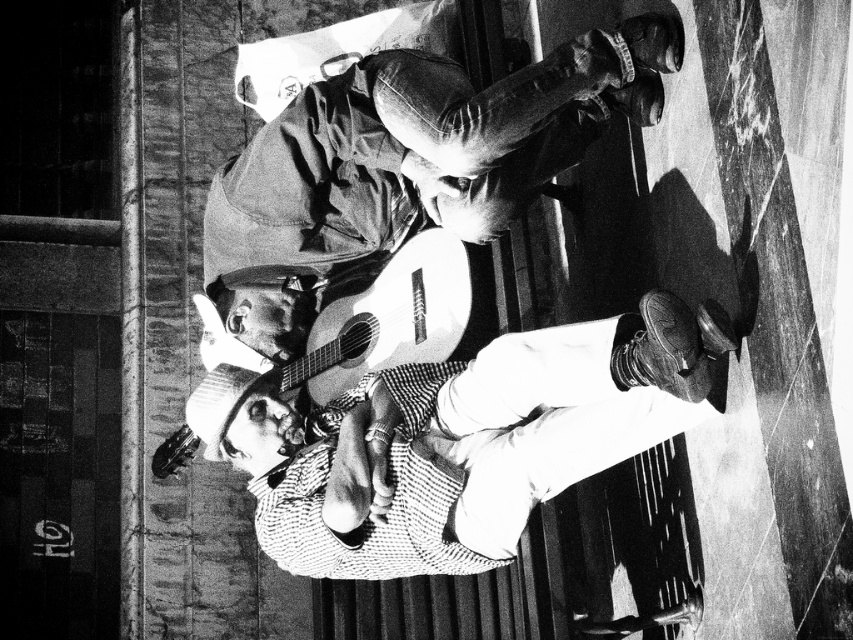
Consider the image. Which is above, checkered fabric shirt at center or leather jacket at upper center?

leather jacket at upper center

Is checkered fabric shirt at center to the left of leather jacket at upper center from the viewer's perspective?

Incorrect, checkered fabric shirt at center is not on the left side of leather jacket at upper center.

Does point (474, 538) come closer to viewer compared to point (498, 228)?

Yes.

Locate an element on the screen. checkered fabric shirt at center is located at coordinates click(x=457, y=440).